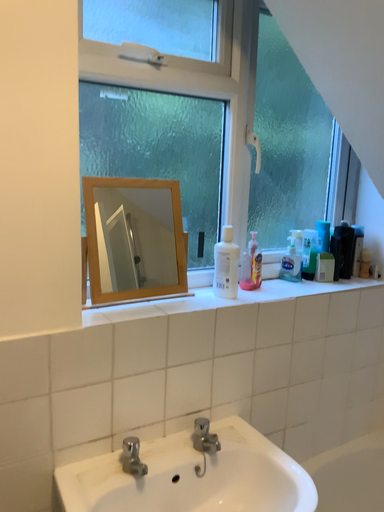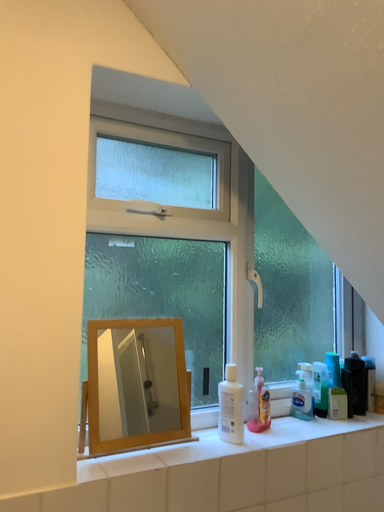
Question: Which way did the camera rotate in the video?

Choices:
 (A) rotated downward
 (B) rotated upward

Answer: (B)